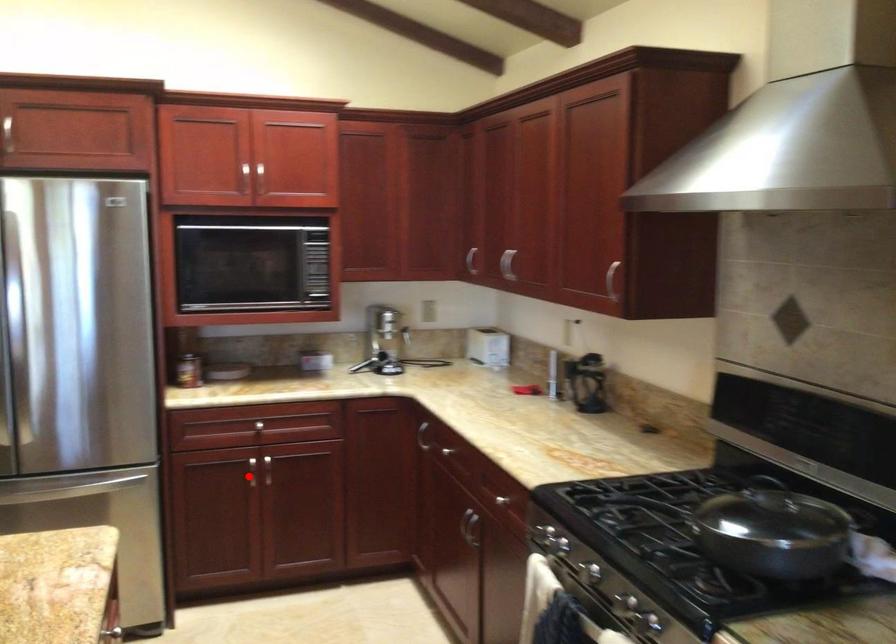
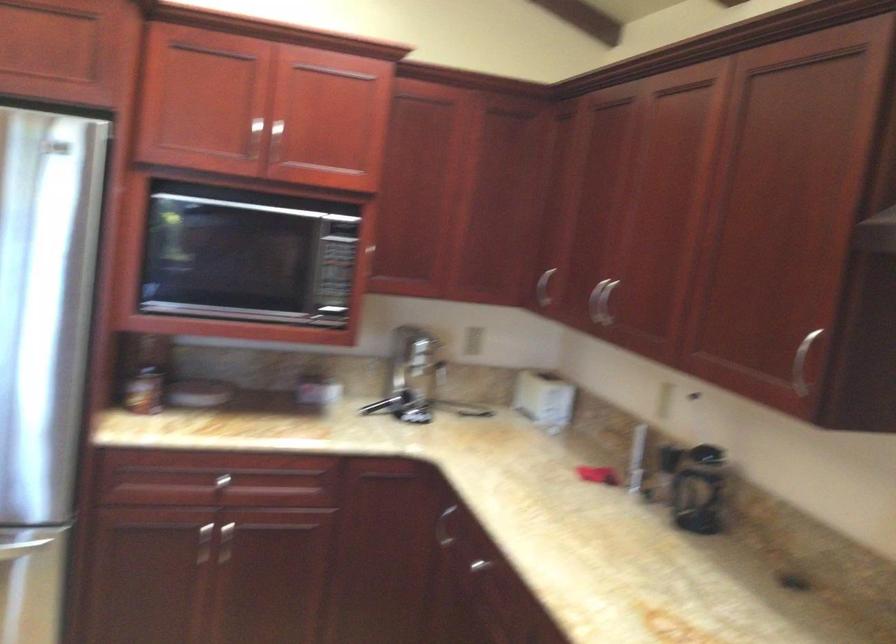
Question: I am providing you with two images of the same scene from different viewpoints. A red point is marked on the first image. At the location where the point appears in image 1, is it still visible in image 2?

Choices:
 (A) Yes
 (B) No

Answer: (A)